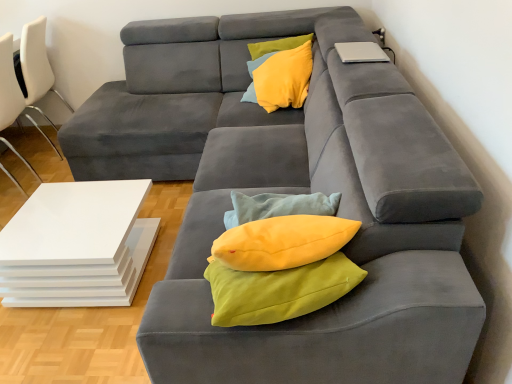
Identify the location of empty space that is ontop of white glossy table at lower left (from a real-world perspective). This screenshot has height=384, width=512. (61, 221).